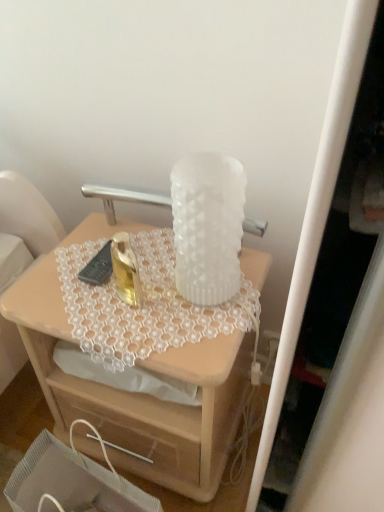
Question: Does translucent glass vase at upper center turn towards wooden drawer at lower center?

Choices:
 (A) no
 (B) yes

Answer: (B)

Question: From the image's perspective, is translucent glass vase at upper center below wooden drawer at lower center?

Choices:
 (A) no
 (B) yes

Answer: (A)

Question: Does translucent glass vase at upper center lie in front of wooden drawer at lower center?

Choices:
 (A) yes
 (B) no

Answer: (B)

Question: Can you confirm if translucent glass vase at upper center is smaller than wooden drawer at lower center?

Choices:
 (A) no
 (B) yes

Answer: (A)

Question: Does translucent glass vase at upper center have a larger size compared to wooden drawer at lower center?

Choices:
 (A) no
 (B) yes

Answer: (B)

Question: Considering the relative sizes of translucent glass vase at upper center and wooden drawer at lower center in the image provided, is translucent glass vase at upper center shorter than wooden drawer at lower center?

Choices:
 (A) yes
 (B) no

Answer: (B)

Question: Does wooden drawer at lower center appear on the right side of white frosted vase at center?

Choices:
 (A) yes
 (B) no

Answer: (B)

Question: Is wooden drawer at lower center in contact with white frosted vase at center?

Choices:
 (A) no
 (B) yes

Answer: (A)

Question: Is wooden drawer at lower center further to the viewer compared to white frosted vase at center?

Choices:
 (A) yes
 (B) no

Answer: (B)

Question: From the image's perspective, is wooden drawer at lower center located beneath white frosted vase at center?

Choices:
 (A) yes
 (B) no

Answer: (A)

Question: Is wooden drawer at lower center completely or partially outside of white frosted vase at center?

Choices:
 (A) yes
 (B) no

Answer: (A)

Question: Does wooden drawer at lower center come in front of white frosted vase at center?

Choices:
 (A) yes
 (B) no

Answer: (A)

Question: Is white frosted vase at center positioned before translucent glass vase at upper center?

Choices:
 (A) no
 (B) yes

Answer: (B)